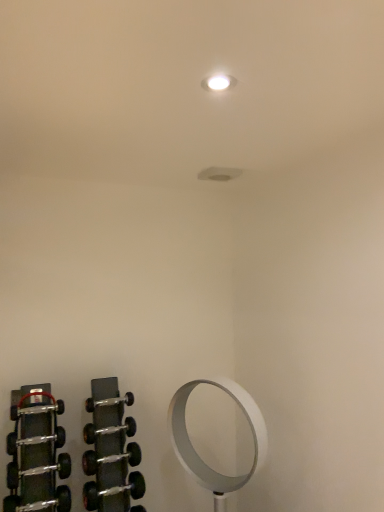
Question: Considering the relative sizes of white metallic mirror at lower right and black rubber dumbbell at lower left, which is the 7th dumbbell in top-to-bottom order, in the image provided, is white metallic mirror at lower right shorter than black rubber dumbbell at lower left, which is the 7th dumbbell in top-to-bottom order,?

Choices:
 (A) no
 (B) yes

Answer: (A)

Question: Considering the relative sizes of white metallic mirror at lower right and black rubber dumbbell at lower left, the second dumbbell when ordered from bottom to top, in the image provided, is white metallic mirror at lower right thinner than black rubber dumbbell at lower left, the second dumbbell when ordered from bottom to top,?

Choices:
 (A) no
 (B) yes

Answer: (A)

Question: Is white metallic mirror at lower right with black rubber dumbbell at lower left, the second dumbbell when ordered from bottom to top?

Choices:
 (A) no
 (B) yes

Answer: (A)

Question: Is white metallic mirror at lower right not close to black rubber dumbbell at lower left, the second dumbbell when ordered from bottom to top?

Choices:
 (A) yes
 (B) no

Answer: (B)

Question: Does white metallic mirror at lower right come behind black rubber dumbbell at lower left, the second dumbbell when ordered from bottom to top?

Choices:
 (A) yes
 (B) no

Answer: (A)

Question: Can you confirm if white metallic mirror at lower right is smaller than black rubber dumbbell at lower left, which is the 7th dumbbell in top-to-bottom order?

Choices:
 (A) yes
 (B) no

Answer: (B)

Question: Is black rubber dumbbell at lower left, the second dumbbell when ordered from bottom to top, surrounded by silver metallic dumbbell at lower left, the fourth dumbbell positioned from the top?

Choices:
 (A) no
 (B) yes

Answer: (A)

Question: Is silver metallic dumbbell at lower left, the fourth dumbbell positioned from the top, oriented towards black rubber dumbbell at lower left, which is the 7th dumbbell in top-to-bottom order?

Choices:
 (A) yes
 (B) no

Answer: (B)

Question: Is the depth of silver metallic dumbbell at lower left, placed as the 5th dumbbell when sorted from bottom to top, less than that of black rubber dumbbell at lower left, which is the 7th dumbbell in top-to-bottom order?

Choices:
 (A) no
 (B) yes

Answer: (A)

Question: Does silver metallic dumbbell at lower left, placed as the 5th dumbbell when sorted from bottom to top, appear on the right side of black rubber dumbbell at lower left, the second dumbbell when ordered from bottom to top?

Choices:
 (A) yes
 (B) no

Answer: (A)

Question: From a real-world perspective, is silver metallic dumbbell at lower left, the fourth dumbbell positioned from the top, under black rubber dumbbell at lower left, which is the 7th dumbbell in top-to-bottom order?

Choices:
 (A) no
 (B) yes

Answer: (A)

Question: Considering the relative sizes of silver metallic dumbbell at lower left, the fourth dumbbell positioned from the top, and black rubber dumbbell at lower left, which is the 7th dumbbell in top-to-bottom order, in the image provided, is silver metallic dumbbell at lower left, the fourth dumbbell positioned from the top, thinner than black rubber dumbbell at lower left, which is the 7th dumbbell in top-to-bottom order,?

Choices:
 (A) yes
 (B) no

Answer: (A)

Question: Can you see polished silver dumbbell at lower left, the seventh dumbbell in the bottom-to-top sequence, touching white metallic mirror at lower right?

Choices:
 (A) no
 (B) yes

Answer: (A)